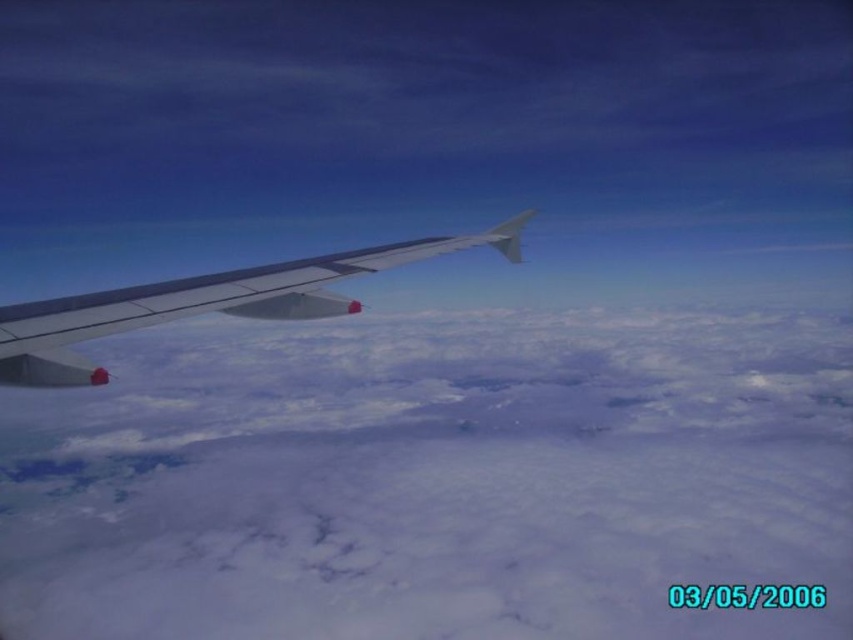
You are a pilot looking out the airplane window. You notice a white fluffy cloud at left. Can you estimate its 2D coordinates in the image?

The white fluffy cloud at left is located at the 2D coordinates of point [433,477].

You are a passenger sitting in an airplane seat and looking out the window. You see the white fluffy cloud at left and the metallic gray wing at left. Which object is closer to the right side of your view?

The white fluffy cloud at left is closer to the right side of your view because it is positioned to the right of the metallic gray wing at left.